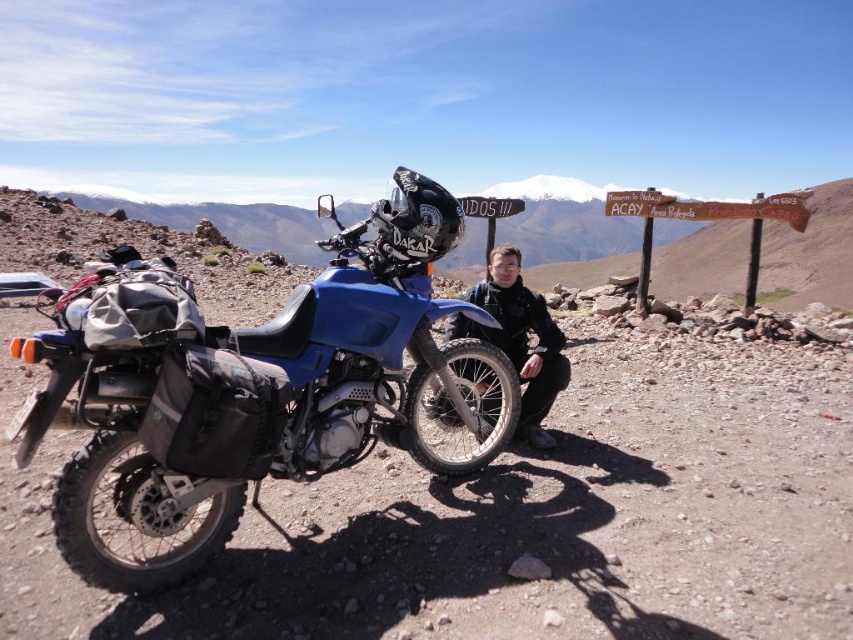
You are a photographer trying to capture a wide shot of the blue rubber tire at lower left and the black matte jacket at center. Your camera can only focus on objects within a 2 meter range. Will both objects be in focus if you position yourself exactly between them?

The blue rubber tire at lower left and black matte jacket at center are 1.75 meters apart from each other. If you position yourself exactly between them, the distance from each object to the camera would be half of 1.75 meters, which is 0.875 meters. Since both distances are within the 2 meter range, both objects will be in focus.